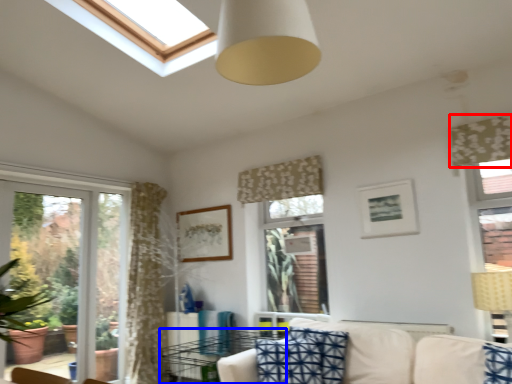
Question: Which object appears farthest to the camera in this image, curtain (highlighted by a red box) or table (highlighted by a blue box)?

Choices:
 (A) curtain
 (B) table

Answer: (B)